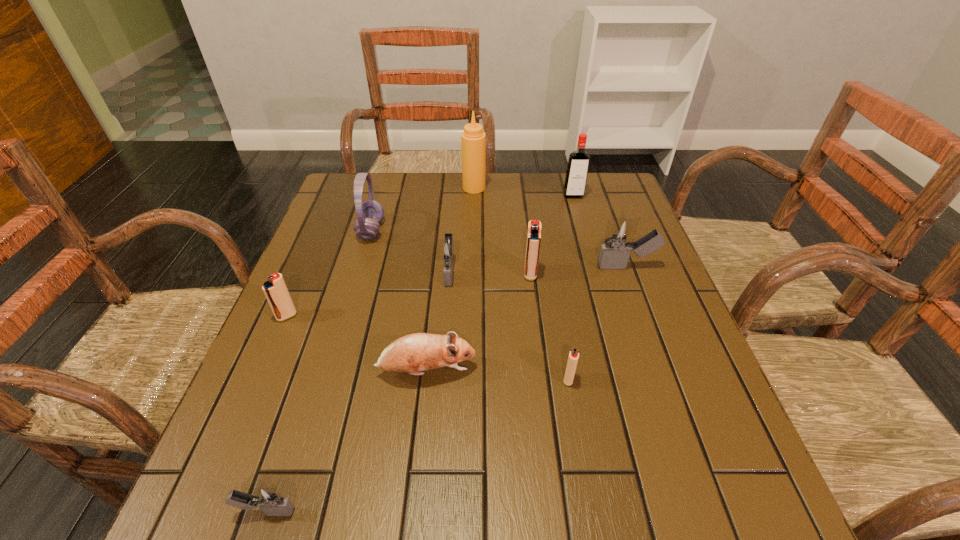
This screenshot has height=540, width=960. Find the location of `free space at the near left corner of the desktop`. free space at the near left corner of the desktop is located at coordinates (230, 517).

Find the location of a particular element. The width and height of the screenshot is (960, 540). vacant space at the far right corner of the desktop is located at coordinates click(x=604, y=193).

I want to click on vacant area that lies between the brown hamster and the third farthest object, so click(x=398, y=301).

Where is `vacant area that lies between the rightmost red igniter and the biggest gray igniter`? This screenshot has height=540, width=960. vacant area that lies between the rightmost red igniter and the biggest gray igniter is located at coordinates (597, 323).

At what (x,y) coordinates should I click in order to perform the action: click on vacant space that's between the red vodka and the rightmost gray igniter. Please return your answer as a coordinate pair (x, y). The width and height of the screenshot is (960, 540). Looking at the image, I should click on (600, 231).

The image size is (960, 540). Find the location of `free spot between the headset and the rightmost red igniter`. free spot between the headset and the rightmost red igniter is located at coordinates (469, 305).

The width and height of the screenshot is (960, 540). In order to click on free area in between the vodka and the eighth nearest object in this screenshot , I will do `click(472, 213)`.

Image resolution: width=960 pixels, height=540 pixels. What are the coordinates of `free space between the second biggest gray igniter and the third object from right to left` in the screenshot? It's located at (509, 325).

This screenshot has height=540, width=960. Find the location of `free space between the tallest object and the nearest igniter`. free space between the tallest object and the nearest igniter is located at coordinates (371, 349).

You are a GUI agent. You are given a task and a screenshot of the screen. Output one action in this format:
    pyautogui.click(x=<x>, y=<y>)
    Task: Click on the empty space between the condiment and the biggest gray igniter
    
    Given the screenshot: What is the action you would take?
    pyautogui.click(x=550, y=227)